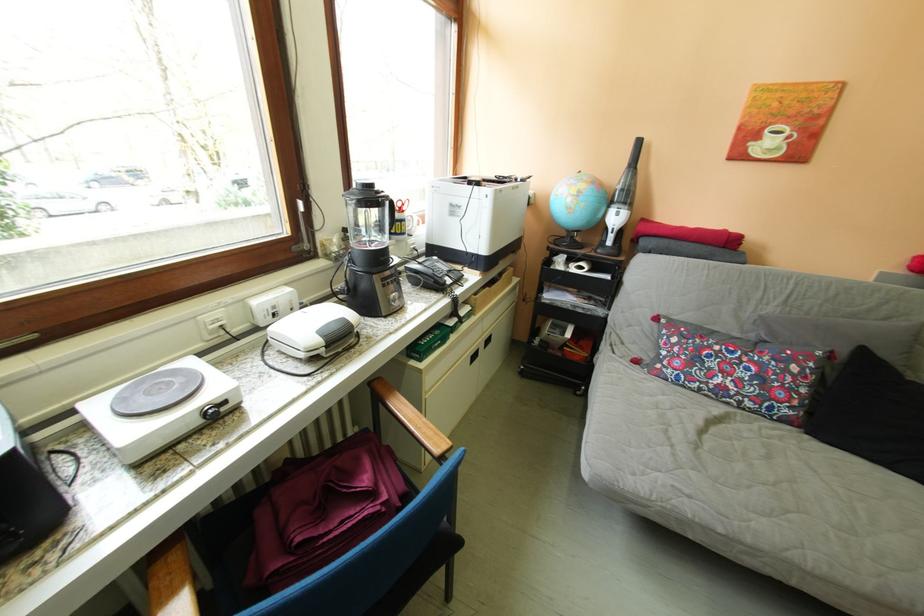
Where is `grey pillow`? The width and height of the screenshot is (924, 616). grey pillow is located at coordinates (871, 414).